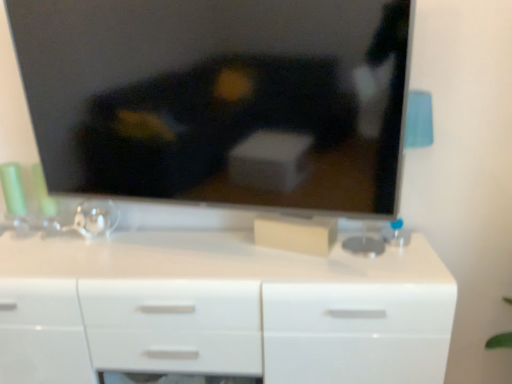
The width and height of the screenshot is (512, 384). What do you see at coordinates (220, 100) in the screenshot?
I see `matte black tv at upper center` at bounding box center [220, 100].

Identify the location of matte black tv at upper center. The width and height of the screenshot is (512, 384). (220, 100).

What is the approximate height of matte black tv at upper center?

24.88 inches.

What do you see at coordinates (221, 310) in the screenshot? I see `white glossy chest of drawers at center` at bounding box center [221, 310].

I want to click on white glossy chest of drawers at center, so (x=221, y=310).

Find the location of `matte black tv at upper center`. matte black tv at upper center is located at coordinates (220, 100).

Considering the relative positions of white glossy chest of drawers at center and matte black tv at upper center in the image provided, is white glossy chest of drawers at center to the right of matte black tv at upper center from the viewer's perspective?

In fact, white glossy chest of drawers at center is to the left of matte black tv at upper center.

Relative to matte black tv at upper center, is white glossy chest of drawers at center in front or behind?

Clearly, white glossy chest of drawers at center is behind matte black tv at upper center.

Considering the points (332, 338) and (287, 0), which point is behind, point (332, 338) or point (287, 0)?

The point (332, 338) is behind.

Based on the photo, from the image's perspective, is white glossy chest of drawers at center under matte black tv at upper center?

Yes, from the image's perspective, white glossy chest of drawers at center is beneath matte black tv at upper center.

From a real-world perspective, is white glossy chest of drawers at center positioned over matte black tv at upper center based on gravity?

No, from a real-world perspective, white glossy chest of drawers at center is not over matte black tv at upper center

Which object is wider, white glossy chest of drawers at center or matte black tv at upper center?

Wider between the two is white glossy chest of drawers at center.

Is white glossy chest of drawers at center taller than matte black tv at upper center?

Yes, white glossy chest of drawers at center is taller than matte black tv at upper center.

Considering the sizes of white glossy chest of drawers at center and matte black tv at upper center in the image, is white glossy chest of drawers at center bigger or smaller than matte black tv at upper center?

In the image, white glossy chest of drawers at center appears to be larger than matte black tv at upper center.

Is white glossy chest of drawers at center spatially inside matte black tv at upper center, or outside of it?

white glossy chest of drawers at center lies outside matte black tv at upper center.

Would you say white glossy chest of drawers at center is a long distance from matte black tv at upper center?

No.

Is white glossy chest of drawers at center oriented towards matte black tv at upper center?

No.

How many degrees apart are the facing directions of white glossy chest of drawers at center and matte black tv at upper center?

The angle between the facing direction of white glossy chest of drawers at center and the facing direction of matte black tv at upper center is 11.7 degrees.

Consider the image. How much distance is there between white glossy chest of drawers at center and matte black tv at upper center?

The distance of white glossy chest of drawers at center from matte black tv at upper center is 16.45 inches.

I want to click on the chest of drawers behind the matte black tv at upper center, so click(221, 310).

Between matte black tv at upper center and white glossy chest of drawers at center, which one appears on the left side from the viewer's perspective?

white glossy chest of drawers at center is more to the left.

Is matte black tv at upper center further to the viewer compared to white glossy chest of drawers at center?

No, the depth of matte black tv at upper center is less than that of white glossy chest of drawers at center.

Considering the points (296, 109) and (369, 351), which point is in front, point (296, 109) or point (369, 351)?

Positioned in front is point (296, 109).

From the image's perspective, is matte black tv at upper center over white glossy chest of drawers at center?

Indeed, from the image's perspective, matte black tv at upper center is shown above white glossy chest of drawers at center.

From a real-world perspective, does matte black tv at upper center stand above white glossy chest of drawers at center?

Correct, in the physical world, matte black tv at upper center is higher than white glossy chest of drawers at center.

Based on the photo, does matte black tv at upper center have a lesser width compared to white glossy chest of drawers at center?

Correct, the width of matte black tv at upper center is less than that of white glossy chest of drawers at center.

Which of these two, matte black tv at upper center or white glossy chest of drawers at center, stands taller?

white glossy chest of drawers at center.

Looking at the image, does matte black tv at upper center seem bigger or smaller compared to white glossy chest of drawers at center?

matte black tv at upper center is smaller than white glossy chest of drawers at center.

Is white glossy chest of drawers at center inside matte black tv at upper center?

That's incorrect, white glossy chest of drawers at center is not inside matte black tv at upper center.

Is matte black tv at upper center with white glossy chest of drawers at center?

No.

Is white glossy chest of drawers at center at the back of matte black tv at upper center?

That's not correct — matte black tv at upper center is not looking away from white glossy chest of drawers at center.

How different are the orientations of matte black tv at upper center and white glossy chest of drawers at center in degrees?

The angular difference between matte black tv at upper center and white glossy chest of drawers at center is 11.7 degrees.

Locate an element on the screen. television that appears above the white glossy chest of drawers at center (from the image's perspective) is located at coordinates (220, 100).

Identify the location of television above the white glossy chest of drawers at center (from the image's perspective). The image size is (512, 384). (220, 100).

Identify the location of the chest of drawers located underneath the matte black tv at upper center (from a real-world perspective). The height and width of the screenshot is (384, 512). (221, 310).